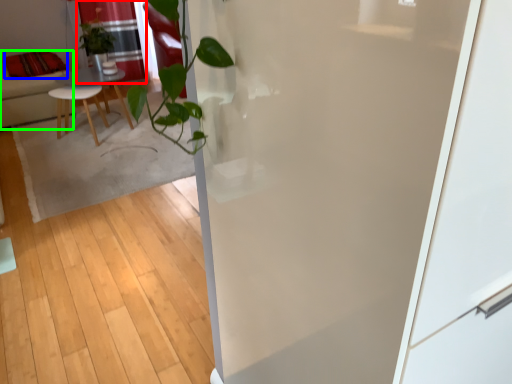
Question: Which object is the farthest from curtain (highlighted by a red box)? Choose among these: pillow (highlighted by a blue box) or furniture (highlighted by a green box).

Choices:
 (A) pillow
 (B) furniture

Answer: (B)